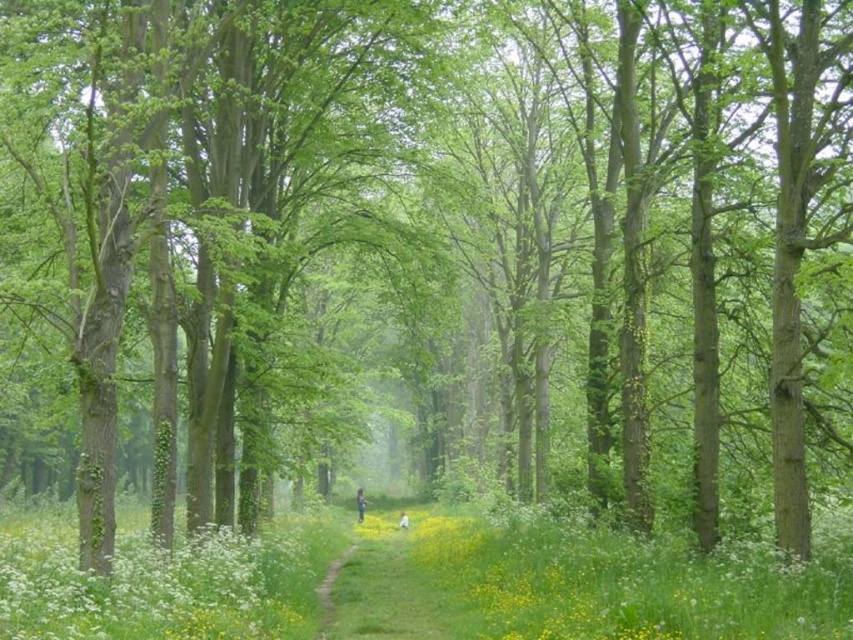
Question: Does green soft grass at lower center have a larger size compared to white fluffy flowers at lower left?

Choices:
 (A) no
 (B) yes

Answer: (B)

Question: In this image, where is green soft grass at lower center located relative to white fluffy flowers at lower left?

Choices:
 (A) below
 (B) above

Answer: (A)

Question: Is green soft grass at lower center behind white fluffy flowers at lower left?

Choices:
 (A) yes
 (B) no

Answer: (A)

Question: Among these objects, which one is nearest to the camera?

Choices:
 (A) white fluffy flowers at lower left
 (B) green soft grass at lower center

Answer: (A)